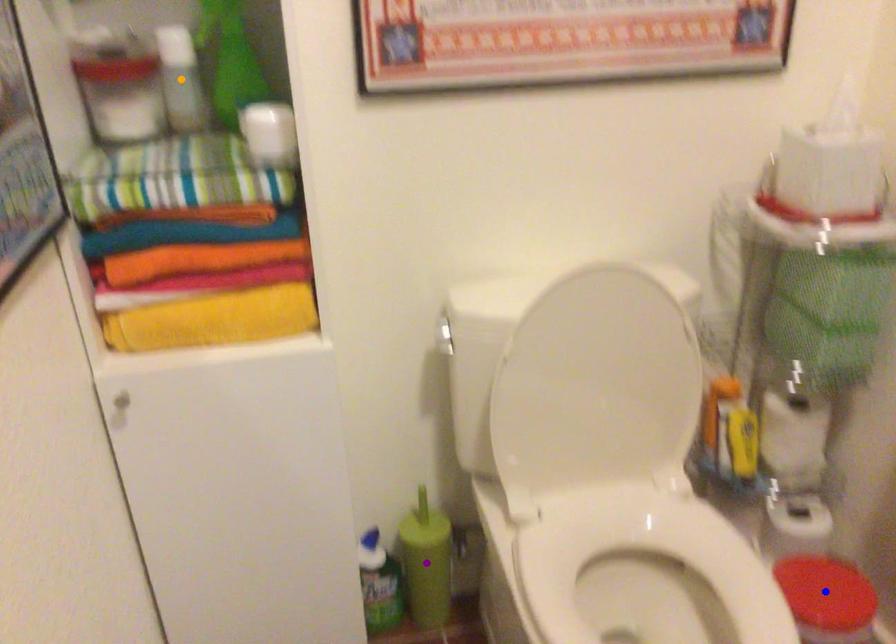
Order these from nearest to farthest:
A) purple point
B) blue point
C) orange point

orange point → blue point → purple point